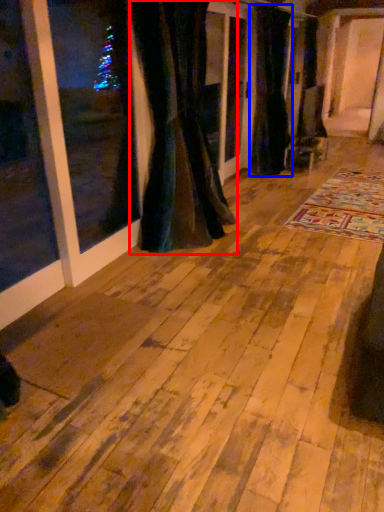
Question: Among these objects, which one is nearest to the camera, curtain (highlighted by a red box) or curtain (highlighted by a blue box)?

Choices:
 (A) curtain
 (B) curtain

Answer: (A)